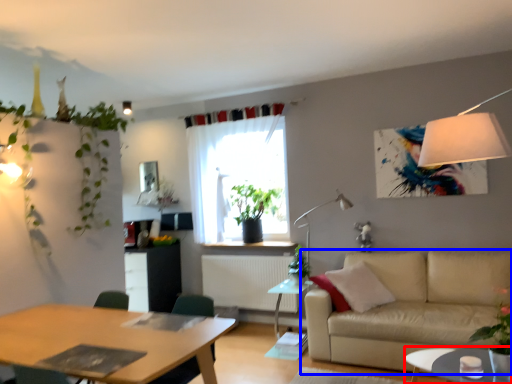
Question: Which point is further to the camera, coffee table (highlighted by a red box) or studio couch (highlighted by a blue box)?

Choices:
 (A) coffee table
 (B) studio couch

Answer: (B)